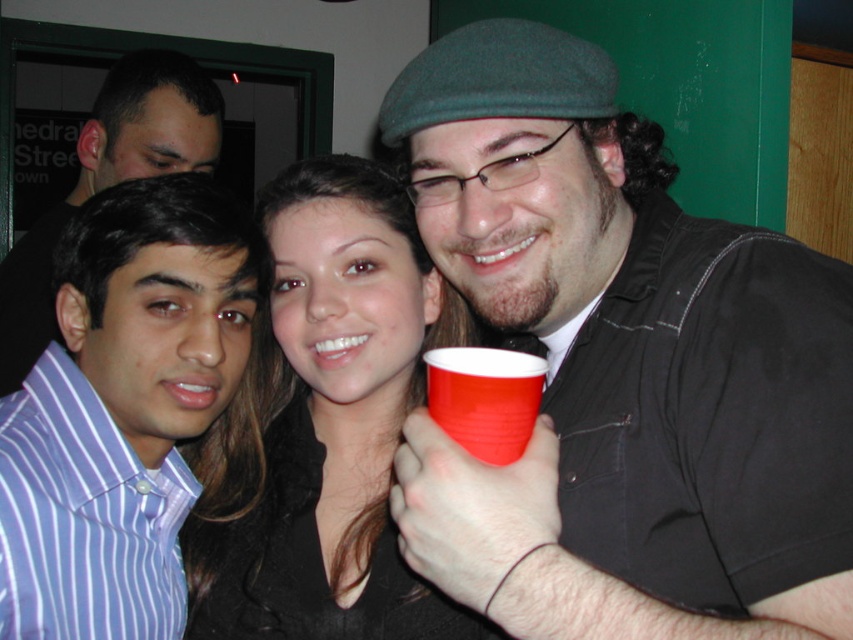
Question: Does matte black shirt at center have a smaller size compared to smooth black shirt at center?

Choices:
 (A) no
 (B) yes

Answer: (A)

Question: Considering the relative positions of matte striped shirt at left and matte plastic cup at center in the image provided, where is matte striped shirt at left located with respect to matte plastic cup at center?

Choices:
 (A) below
 (B) above

Answer: (B)

Question: Among these objects, which one is nearest to the camera?

Choices:
 (A) matte striped shirt at left
 (B) matte black shirt at center
 (C) purple striped shirt at left

Answer: (B)

Question: Which point is farther to the camera?

Choices:
 (A) matte plastic cup at center
 (B) purple striped shirt at left

Answer: (B)

Question: Which of the following is the farthest from the observer?

Choices:
 (A) purple striped shirt at left
 (B) matte black shirt at center

Answer: (A)

Question: From the image, what is the correct spatial relationship of matte black shirt at center in relation to smooth black shirt at center?

Choices:
 (A) left
 (B) right

Answer: (B)